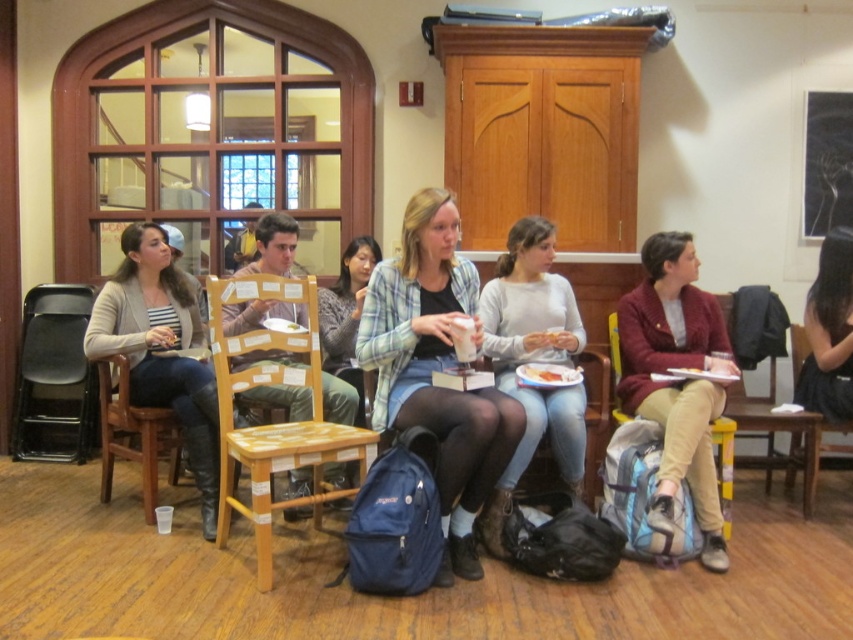
Question: Which object is positioned closest to the black plastic chair at left?

Choices:
 (A) wooden chair at center
 (B) matte blue backpack at center

Answer: (B)

Question: Does plaid shirt at center lie behind matte blue backpack at center?

Choices:
 (A) no
 (B) yes

Answer: (A)

Question: Considering the real-world distances, which object is closest to the maroon woolen sweater at right?

Choices:
 (A) white paper plate at center
 (B) matte blue backpack at center

Answer: (A)

Question: Among these points, which one is nearest to the camera?

Choices:
 (A) click(x=189, y=289)
 (B) click(x=544, y=372)
 (C) click(x=793, y=436)
 (D) click(x=567, y=406)

Answer: (D)

Question: Is maroon woolen sweater at right further to camera compared to black plastic chair at left?

Choices:
 (A) no
 (B) yes

Answer: (A)

Question: Is wooden chair at right positioned in front of matte blue backpack at center?

Choices:
 (A) no
 (B) yes

Answer: (A)